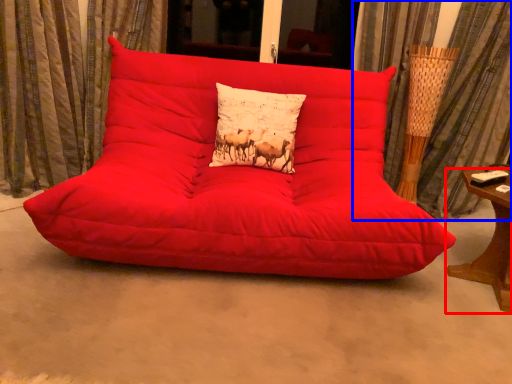
Question: Which point is further to the camera, table (highlighted by a red box) or curtain (highlighted by a blue box)?

Choices:
 (A) table
 (B) curtain

Answer: (B)